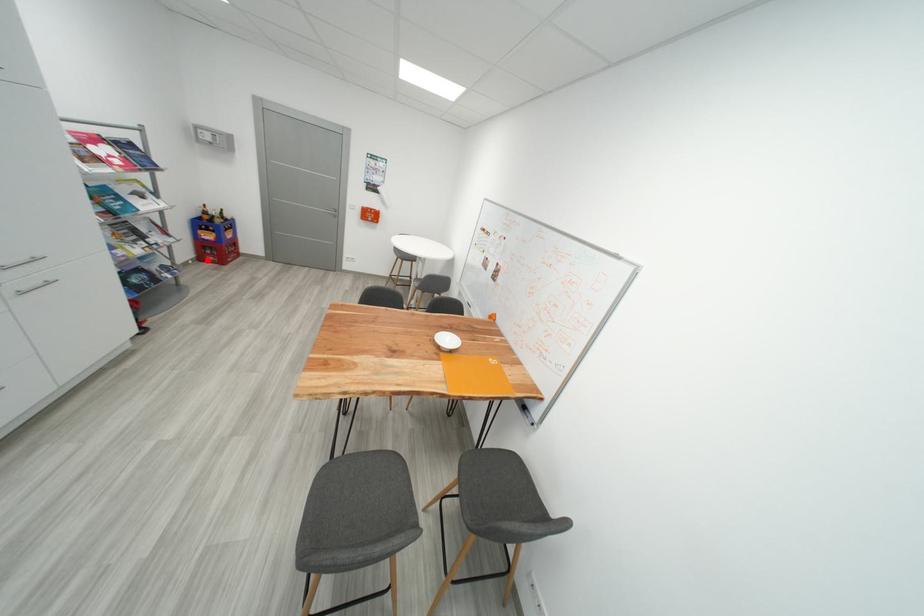
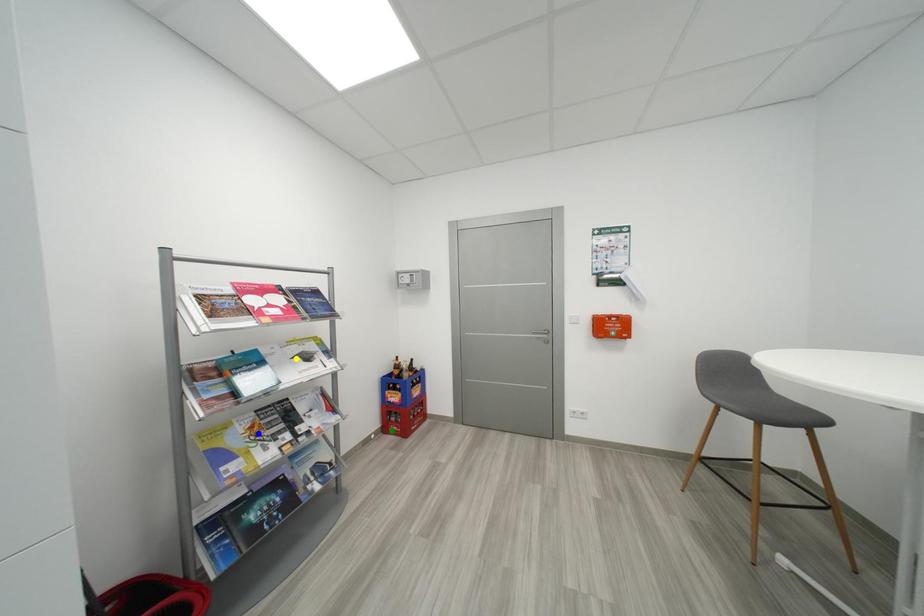
Question: I am providing you with two images of the same scene from different viewpoints. A red point is marked on the first image. You are given multiple points on the second image. Which point in image 2 represents the same 3d spot as the red point in image 1?

Choices:
 (A) blue point
 (B) yellow point
 (C) green point

Answer: (C)